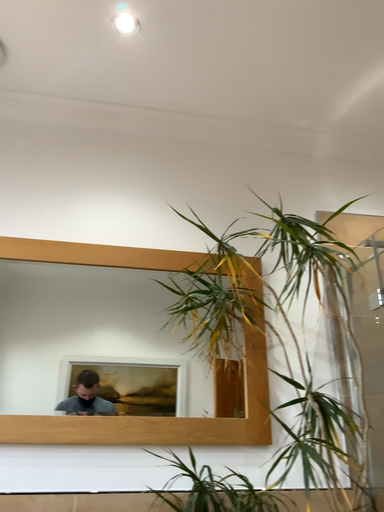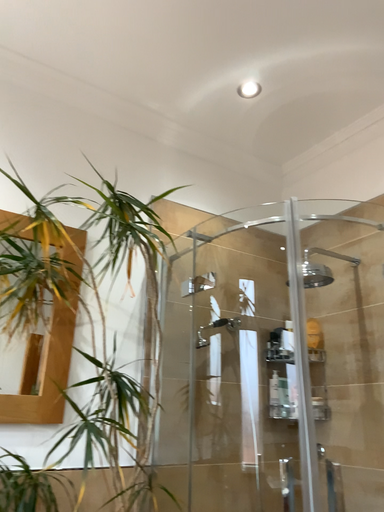
Question: Which way did the camera rotate in the video?

Choices:
 (A) rotated right
 (B) rotated left

Answer: (A)